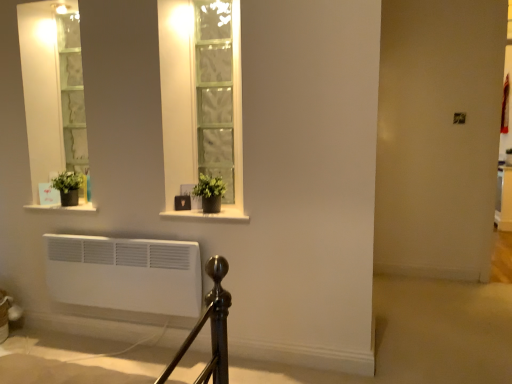
Question: From their relative heights in the image, would you say matte black pot at lower left, which is the first window sill from left to right, is taller or shorter than green matte plant at left, which appears as the 2th houseplant when viewed from the right?

Choices:
 (A) short
 (B) tall

Answer: (A)

Question: Considering the relative positions of matte black pot at lower left, placed as the 2th window sill when sorted from right to left, and green matte plant at left, the first houseplant in the back-to-front sequence, in the image provided, is matte black pot at lower left, placed as the 2th window sill when sorted from right to left, to the left or to the right of green matte plant at left, the first houseplant in the back-to-front sequence,?

Choices:
 (A) left
 (B) right

Answer: (A)

Question: Which object is positioned closest to the matte black pot at center, the 2th window sill positioned from the left?

Choices:
 (A) green matte plant at center, the second houseplant in the back-to-front sequence
 (B) matte black pot at lower left, which is the first window sill from left to right
 (C) green matte plant at left, which appears as the 1th houseplant when viewed from the left

Answer: (A)

Question: Estimate the real-world distances between objects in this image. Which object is closer to the green matte plant at left, which appears as the second houseplant when viewed from the front?

Choices:
 (A) matte black pot at lower left, which is the first window sill from left to right
 (B) matte black pot at center, which appears as the first window sill when viewed from the right
 (C) green matte plant at center, placed as the first houseplant when sorted from front to back

Answer: (A)